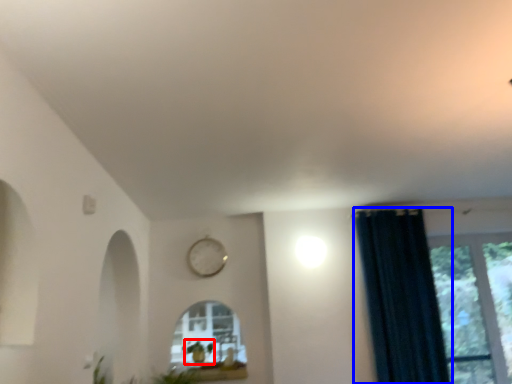
Question: Which object is closer to the camera taking this photo, plant (highlighted by a red box) or curtain (highlighted by a blue box)?

Choices:
 (A) plant
 (B) curtain

Answer: (B)